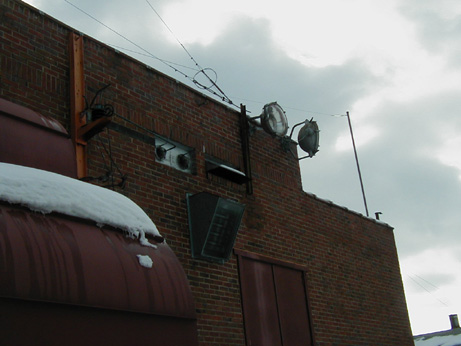
Where is `door`? door is located at coordinates (265, 296), (288, 298).